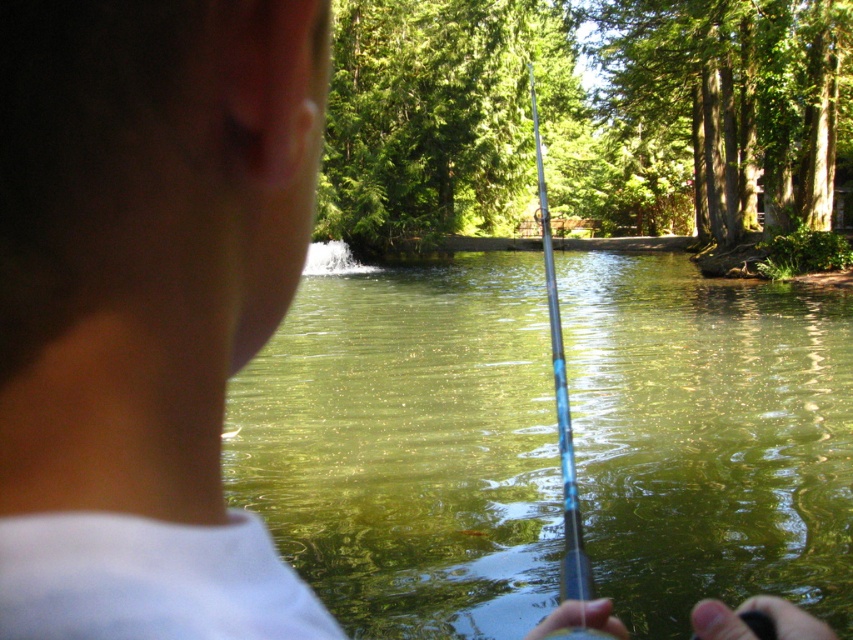
Can you confirm if green translucent water at center is bigger than blue glossy fishing pole at center?

No, green translucent water at center is not bigger than blue glossy fishing pole at center.

Can you confirm if green translucent water at center is taller than blue glossy fishing pole at center?

No, green translucent water at center is not taller than blue glossy fishing pole at center.

Measure the distance between point (788, 492) and camera.

29.45 feet

Image resolution: width=853 pixels, height=640 pixels. Identify the location of green translucent water at center. (408, 444).